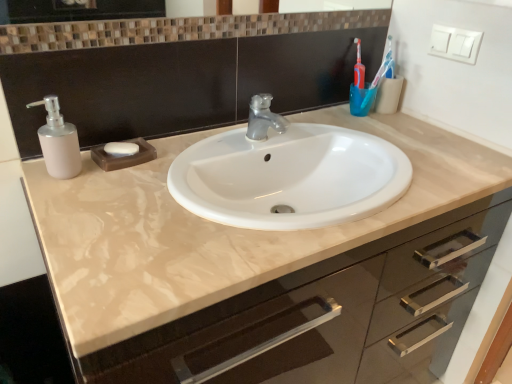
This screenshot has height=384, width=512. What do you see at coordinates (121, 149) in the screenshot?
I see `white matte soap at center` at bounding box center [121, 149].

What do you see at coordinates (330, 310) in the screenshot? This screenshot has width=512, height=384. I see `matte beige cabinet at center` at bounding box center [330, 310].

Find the location of a particular element. The height and width of the screenshot is (384, 512). matte white soap dispenser at left is located at coordinates (58, 141).

From the image's perspective, is matte white soap dispenser at left above or below brown mosaic tile mirror at upper center?

matte white soap dispenser at left is situated lower than brown mosaic tile mirror at upper center in the image.

Does point (74, 176) lie behind point (19, 13)?

Yes, it is.

Which of these two, matte white soap dispenser at left or brown mosaic tile mirror at upper center, stands shorter?

brown mosaic tile mirror at upper center.

From a real-world perspective, relative to brown mosaic tile mirror at upper center, is matte white soap dispenser at left vertically above or below?

matte white soap dispenser at left is below brown mosaic tile mirror at upper center.

Does blue plastic toothbrush at upper right have a lesser height compared to white matte soap at center?

Incorrect, the height of blue plastic toothbrush at upper right does not fall short of that of white matte soap at center.

Considering the positions of objects blue plastic toothbrush at upper right and white matte soap at center in the image provided, who is more to the left, blue plastic toothbrush at upper right or white matte soap at center?

From the viewer's perspective, white matte soap at center appears more on the left side.

In the scene shown: Considering the relative sizes of blue plastic toothbrush at upper right and white matte soap at center in the image provided, is blue plastic toothbrush at upper right smaller than white matte soap at center?

Result: No, blue plastic toothbrush at upper right is not smaller than white matte soap at center.

Where is `soap dispenser in front of the white matte soap at center`? The width and height of the screenshot is (512, 384). soap dispenser in front of the white matte soap at center is located at coordinates (58, 141).

From a real-world perspective, is matte white soap dispenser at left beneath white matte soap at center?

No, from a real-world perspective, matte white soap dispenser at left is not under white matte soap at center.

Considering the relative positions of matte white soap dispenser at left and white matte soap at center in the image provided, is matte white soap dispenser at left to the left or to the right of white matte soap at center?

In the image, matte white soap dispenser at left appears on the left side of white matte soap at center.

Are matte white soap dispenser at left and white matte soap at center making contact?

matte white soap dispenser at left and white matte soap at center are not in contact.

From a real-world perspective, relative to matte white soap dispenser at left, is brown mosaic tile mirror at upper center vertically above or below?

Clearly, from a real-world perspective, brown mosaic tile mirror at upper center is above matte white soap dispenser at left.

Does brown mosaic tile mirror at upper center have a lesser height compared to matte white soap dispenser at left?

Yes.

Considering the sizes of objects brown mosaic tile mirror at upper center and matte white soap dispenser at left in the image provided, who is thinner, brown mosaic tile mirror at upper center or matte white soap dispenser at left?

Thinner between the two is brown mosaic tile mirror at upper center.

Which object is closer to the camera taking this photo, white matte soap at center or matte white soap dispenser at left?

matte white soap dispenser at left.

Does point (121, 144) come in front of point (57, 139)?

No, (121, 144) is further to viewer.

Would you say white matte soap at center is a long distance from matte white soap dispenser at left?

They are positioned close to each other.

Is white matte soap at center wider or thinner than matte white soap dispenser at left?

white matte soap at center is thinner than matte white soap dispenser at left.

From the image's perspective, which is above, white matte soap at center or matte beige cabinet at center?

From the image's view, white matte soap at center is above.

How far apart are white matte soap at center and matte beige cabinet at center?

27.38 inches.

Locate an element on the screen. The width and height of the screenshot is (512, 384). bathroom cabinet that appears below the white matte soap at center (from the image's perspective) is located at coordinates (330, 310).

Is brown mosaic tile mirror at upper center surrounding matte beige cabinet at center?

Definitely not — matte beige cabinet at center is not inside brown mosaic tile mirror at upper center.

Which of these two, brown mosaic tile mirror at upper center or matte beige cabinet at center, is wider?

With larger width is matte beige cabinet at center.

From the image's perspective, which object appears higher, brown mosaic tile mirror at upper center or matte beige cabinet at center?

brown mosaic tile mirror at upper center, from the image's perspective.

Where is `bathroom cabinet below the brown mosaic tile mirror at upper center (from the image's perspective)`? bathroom cabinet below the brown mosaic tile mirror at upper center (from the image's perspective) is located at coordinates (330, 310).

I want to click on soap dispenser below the brown mosaic tile mirror at upper center (from the image's perspective), so click(x=58, y=141).

What are the coordinates of `toothbrush that appears behind the white matte soap at center` in the screenshot? It's located at (379, 78).

Estimate the real-world distances between objects in this image. Which object is closer to matte white soap dispenser at left, brown mosaic tile mirror at upper center or blue plastic toothbrush at upper right?

brown mosaic tile mirror at upper center is positioned closer to the anchor matte white soap dispenser at left.

Looking at the image, which one is located closer to brown mosaic tile mirror at upper center, matte white soap dispenser at left or blue plastic toothbrush at upper right?

matte white soap dispenser at left is closer to brown mosaic tile mirror at upper center.

Considering their positions, is white matte soap at center positioned closer to matte white soap dispenser at left than blue plastic toothbrush at upper right?

white matte soap at center is positioned closer to the anchor matte white soap dispenser at left.

Considering their positions, is white matte soap at center positioned further to blue plastic toothbrush at upper right than brown mosaic tile mirror at upper center?

Among the two, white matte soap at center is located further to blue plastic toothbrush at upper right.

Looking at the image, which one is located closer to matte beige cabinet at center, blue plastic toothbrush at upper right or matte white soap dispenser at left?

The object closer to matte beige cabinet at center is blue plastic toothbrush at upper right.

When comparing their distances from matte beige cabinet at center, does blue plastic toothbrush at upper right or white matte soap at center seem further?

Based on the image, white matte soap at center appears to be further to matte beige cabinet at center.

In the scene shown: Looking at the image, which one is located further to blue plastic toothbrush at upper right, brown mosaic tile mirror at upper center or matte beige cabinet at center?

Based on the image, brown mosaic tile mirror at upper center appears to be further to blue plastic toothbrush at upper right.

From the image, which object appears to be farther from blue plastic toothbrush at upper right, matte beige cabinet at center or brown mosaic tile mirror at upper center?

The object further to blue plastic toothbrush at upper right is brown mosaic tile mirror at upper center.

The image size is (512, 384). I want to click on soap located between matte white soap dispenser at left and blue plastic toothbrush at upper right in the left-right direction, so click(x=121, y=149).

You are a GUI agent. You are given a task and a screenshot of the screen. Output one action in this format:
    pyautogui.click(x=<x>, y=<y>)
    Task: Click on the soap dispenser between brown mosaic tile mirror at upper center and white matte soap at center vertically
    
    Given the screenshot: What is the action you would take?
    pyautogui.click(x=58, y=141)

This screenshot has height=384, width=512. I want to click on soap dispenser between brown mosaic tile mirror at upper center and matte beige cabinet at center in the vertical direction, so click(x=58, y=141).

Find the location of a particular element. Image resolution: width=512 pixels, height=384 pixels. mirror located between white matte soap at center and blue plastic toothbrush at upper right in the left-right direction is located at coordinates (77, 10).